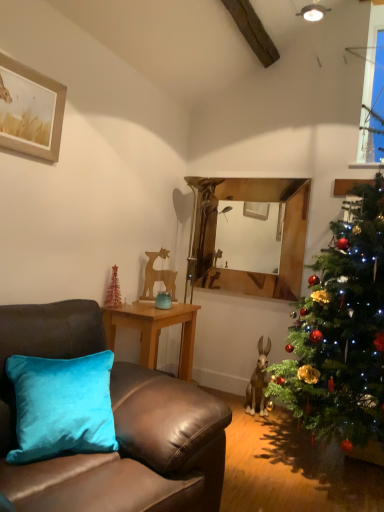
Question: Does metallic gold christmas tree at lower left contain wooden picture frame at upper left?

Choices:
 (A) no
 (B) yes

Answer: (A)

Question: Is metallic gold christmas tree at lower left directly adjacent to wooden picture frame at upper left?

Choices:
 (A) yes
 (B) no

Answer: (B)

Question: Would you say metallic gold christmas tree at lower left is a long distance from wooden picture frame at upper left?

Choices:
 (A) yes
 (B) no

Answer: (A)

Question: From a real-world perspective, is metallic gold christmas tree at lower left positioned under wooden picture frame at upper left based on gravity?

Choices:
 (A) yes
 (B) no

Answer: (A)

Question: Considering the relative sizes of metallic gold christmas tree at lower left and wooden picture frame at upper left in the image provided, is metallic gold christmas tree at lower left bigger than wooden picture frame at upper left?

Choices:
 (A) yes
 (B) no

Answer: (B)

Question: Is woodenobject at center wider or thinner than velvet brown couch at left?

Choices:
 (A) thin
 (B) wide

Answer: (A)

Question: Would you say woodenobject at center is inside or outside velvet brown couch at left?

Choices:
 (A) inside
 (B) outside

Answer: (B)

Question: Relative to velvet brown couch at left, is woodenobject at center in front or behind?

Choices:
 (A) behind
 (B) front

Answer: (A)

Question: Based on their positions, is woodenobject at center located to the left or right of velvet brown couch at left?

Choices:
 (A) right
 (B) left

Answer: (A)

Question: Considering the positions of teal velvet vase at center and green matte christmas tree at right in the image, is teal velvet vase at center taller or shorter than green matte christmas tree at right?

Choices:
 (A) tall
 (B) short

Answer: (B)

Question: Looking at their shapes, would you say teal velvet vase at center is wider or thinner than green matte christmas tree at right?

Choices:
 (A) thin
 (B) wide

Answer: (A)

Question: Is teal velvet vase at center to the left or to the right of green matte christmas tree at right in the image?

Choices:
 (A) left
 (B) right

Answer: (A)

Question: Relative to green matte christmas tree at right, is teal velvet vase at center in front or behind?

Choices:
 (A) behind
 (B) front

Answer: (A)

Question: Would you say green matte christmas tree at right is inside or outside clear glass window at upper right?

Choices:
 (A) outside
 (B) inside

Answer: (A)

Question: In terms of height, does green matte christmas tree at right look taller or shorter compared to clear glass window at upper right?

Choices:
 (A) tall
 (B) short

Answer: (A)